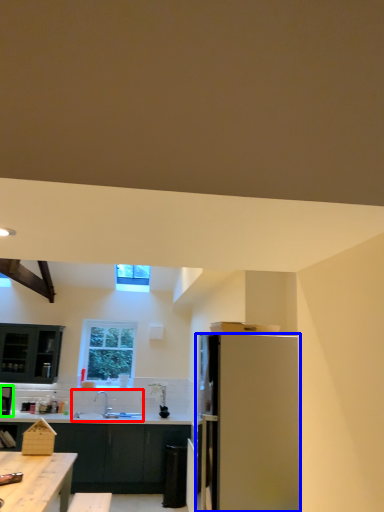
Question: Which is farther away from sink (highlighted by a red box)? refrigerator (highlighted by a blue box) or kitchen appliance (highlighted by a green box)?

Choices:
 (A) refrigerator
 (B) kitchen appliance

Answer: (A)